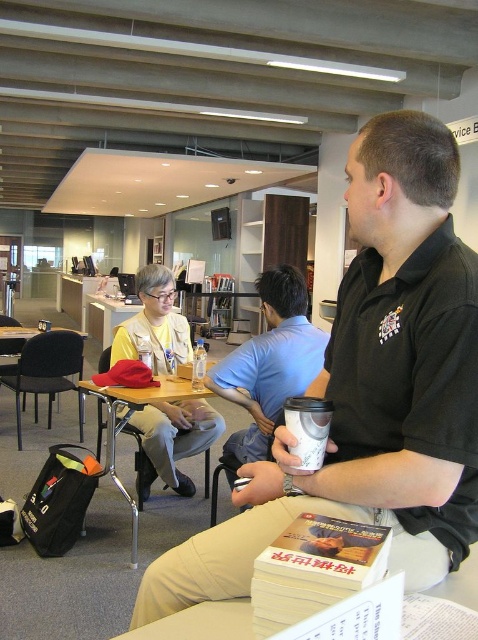
Question: Which object is the farthest from the wooden table at center?

Choices:
 (A) blue cotton shirt at center
 (B) black matte shirt at upper right
 (C) white paper cup at center
 (D) clear glass bottle at center

Answer: (C)

Question: Does black matte shirt at upper right appear on the left side of blue cotton shirt at center?

Choices:
 (A) no
 (B) yes

Answer: (A)

Question: Which of these objects is positioned farthest from the wooden table at center?

Choices:
 (A) black fabric chair at left
 (B) matte plastic chair at center
 (C) white paper cup at center

Answer: (C)

Question: Can you confirm if matte plastic chair at center is positioned below clear glass bottle at center?

Choices:
 (A) no
 (B) yes

Answer: (B)

Question: Does matte plastic chair at center have a larger size compared to clear glass bottle at center?

Choices:
 (A) yes
 (B) no

Answer: (A)

Question: Estimate the real-world distances between objects in this image. Which object is closer to the clear glass bottle at center?

Choices:
 (A) wooden table at center
 (B) blue cotton shirt at center
 (C) white paper cup at center

Answer: (B)